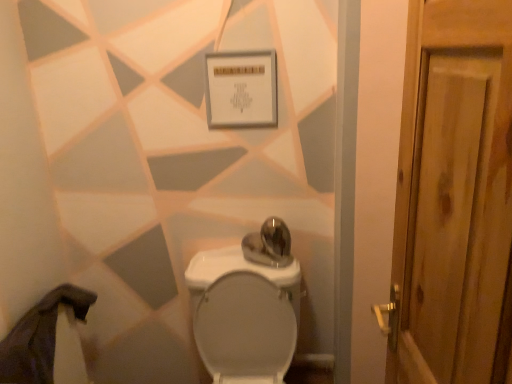
Question: Is white glossy toilet at center not close to white matte sign at upper center?

Choices:
 (A) yes
 (B) no

Answer: (B)

Question: From a real-world perspective, is white glossy toilet at center physically above white matte sign at upper center?

Choices:
 (A) no
 (B) yes

Answer: (A)

Question: Could white matte sign at upper center be considered to be inside white glossy toilet at center?

Choices:
 (A) no
 (B) yes

Answer: (A)

Question: Considering the relative sizes of white glossy toilet at center and white matte sign at upper center in the image provided, is white glossy toilet at center thinner than white matte sign at upper center?

Choices:
 (A) no
 (B) yes

Answer: (A)

Question: Is white glossy toilet at center not within white matte sign at upper center?

Choices:
 (A) no
 (B) yes

Answer: (B)

Question: Is white glossy toilet at center smaller than white matte sign at upper center?

Choices:
 (A) yes
 (B) no

Answer: (B)

Question: From a real-world perspective, does white matte sign at upper center sit lower than white glossy toilet at center?

Choices:
 (A) yes
 (B) no

Answer: (B)

Question: Is white matte sign at upper center taller than white glossy toilet at center?

Choices:
 (A) yes
 (B) no

Answer: (B)

Question: Does white matte sign at upper center have a lesser width compared to white glossy toilet at center?

Choices:
 (A) yes
 (B) no

Answer: (A)

Question: Considering the relative sizes of white matte sign at upper center and white glossy toilet at center in the image provided, is white matte sign at upper center shorter than white glossy toilet at center?

Choices:
 (A) no
 (B) yes

Answer: (B)

Question: Is white matte sign at upper center outside of white glossy toilet at center?

Choices:
 (A) yes
 (B) no

Answer: (A)

Question: Is white glossy toilet at center completely or partially inside white matte sign at upper center?

Choices:
 (A) yes
 (B) no

Answer: (B)

Question: Choose the correct answer: Is white matte sign at upper center inside white glossy toilet at center or outside it?

Choices:
 (A) inside
 (B) outside

Answer: (B)